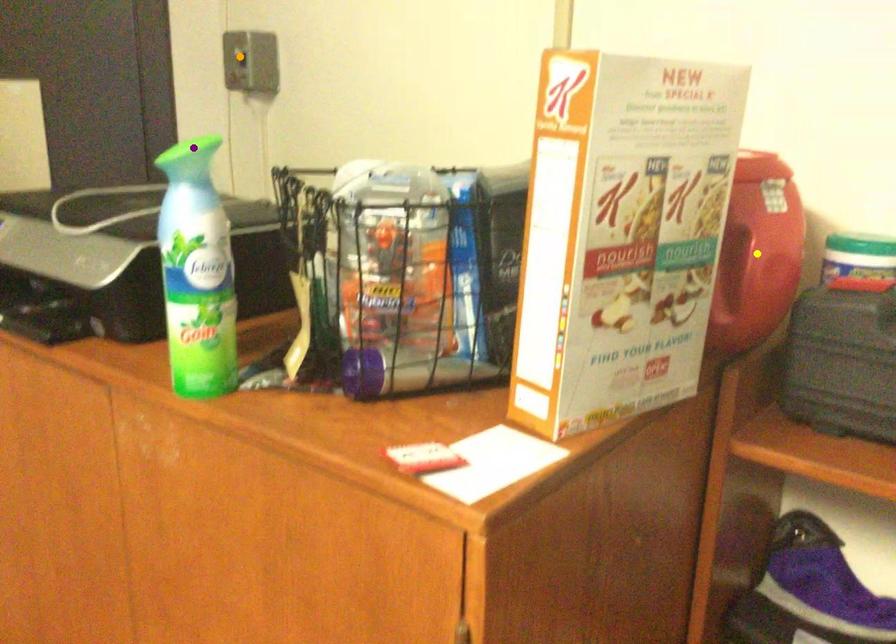
Order these from nearest to farthest:
purple point, yellow point, orange point

purple point → yellow point → orange point